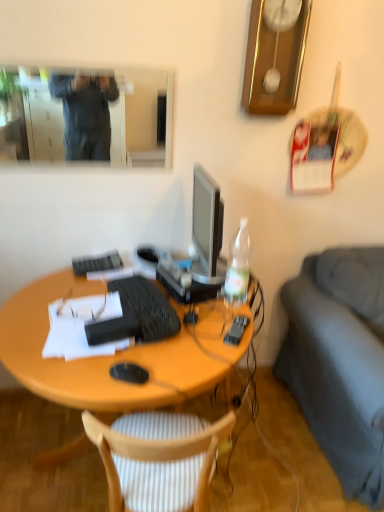
Where is `vacant space situated above black matte keyboard at center, which is the first computer keyboard from front to back (from a real-world perspective)`? vacant space situated above black matte keyboard at center, which is the first computer keyboard from front to back (from a real-world perspective) is located at coordinates (147, 297).